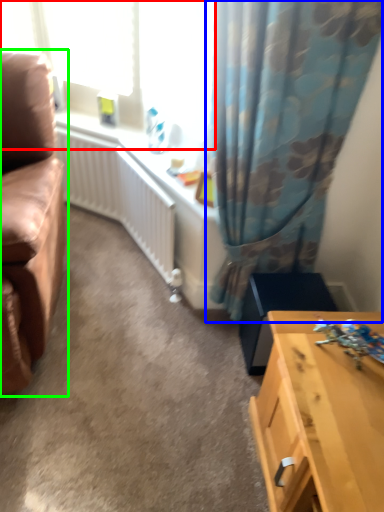
Question: Which is nearer to the window screen (highlighted by a red box)? curtain (highlighted by a blue box) or studio couch (highlighted by a green box).

Choices:
 (A) curtain
 (B) studio couch

Answer: (A)